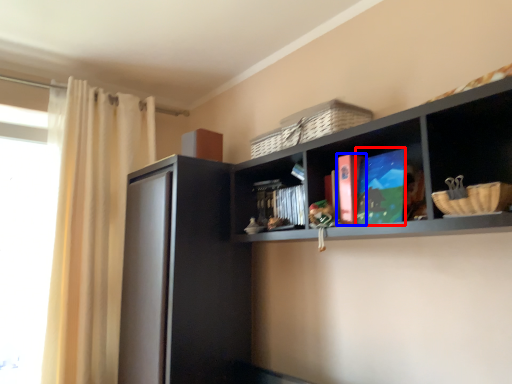
Question: Which point is further to the camera, book (highlighted by a red box) or book (highlighted by a blue box)?

Choices:
 (A) book
 (B) book

Answer: (B)